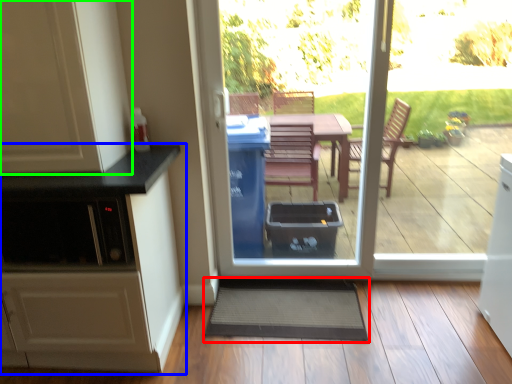
Question: Which is nearer to the doormat (highlighted by a red box)? cabinetry (highlighted by a blue box) or cabinetry (highlighted by a green box).

Choices:
 (A) cabinetry
 (B) cabinetry

Answer: (A)